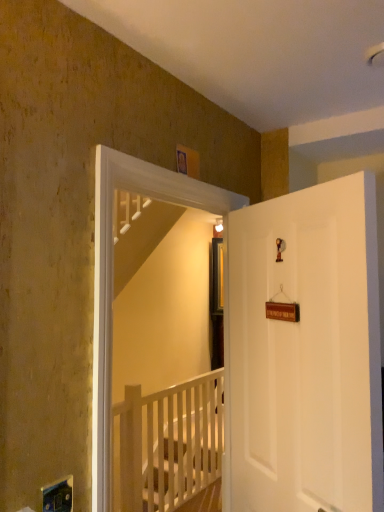
Question: Does white matte door at right have a lesser height compared to white wooden screen door at upper center?

Choices:
 (A) no
 (B) yes

Answer: (B)

Question: Does white matte door at right have a greater width compared to white wooden screen door at upper center?

Choices:
 (A) no
 (B) yes

Answer: (B)

Question: From the image's perspective, is white matte door at right below white wooden screen door at upper center?

Choices:
 (A) yes
 (B) no

Answer: (A)

Question: Is white matte door at right facing away from white wooden screen door at upper center?

Choices:
 (A) yes
 (B) no

Answer: (A)

Question: Does white matte door at right have a smaller size compared to white wooden screen door at upper center?

Choices:
 (A) yes
 (B) no

Answer: (B)

Question: Is white matte door at right in contact with white wooden screen door at upper center?

Choices:
 (A) no
 (B) yes

Answer: (A)

Question: Is white wooden rail at center wider than white wooden screen door at upper center?

Choices:
 (A) no
 (B) yes

Answer: (B)

Question: From a real-world perspective, is white wooden rail at center on white wooden screen door at upper center?

Choices:
 (A) no
 (B) yes

Answer: (A)

Question: Can you confirm if white wooden rail at center is shorter than white wooden screen door at upper center?

Choices:
 (A) yes
 (B) no

Answer: (A)

Question: Is white wooden rail at center positioned with its back to white wooden screen door at upper center?

Choices:
 (A) no
 (B) yes

Answer: (A)

Question: Would you say white wooden screen door at upper center is part of white wooden rail at center's contents?

Choices:
 (A) yes
 (B) no

Answer: (B)

Question: Can you see white wooden rail at center touching white wooden screen door at upper center?

Choices:
 (A) yes
 (B) no

Answer: (B)

Question: From the image's perspective, is white wooden screen door at upper center beneath white matte door at right?

Choices:
 (A) yes
 (B) no

Answer: (B)